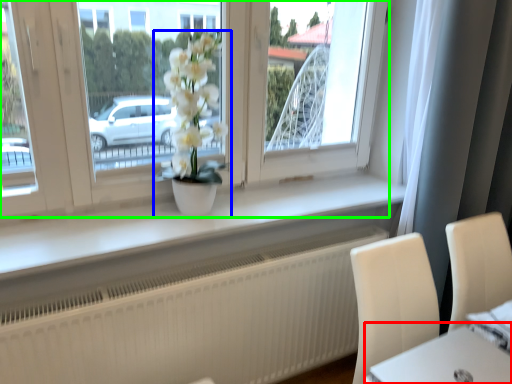
Question: Considering the real-world distances, which object is farthest from round table (highlighted by a red box)? houseplant (highlighted by a blue box) or window (highlighted by a green box)?

Choices:
 (A) houseplant
 (B) window

Answer: (B)